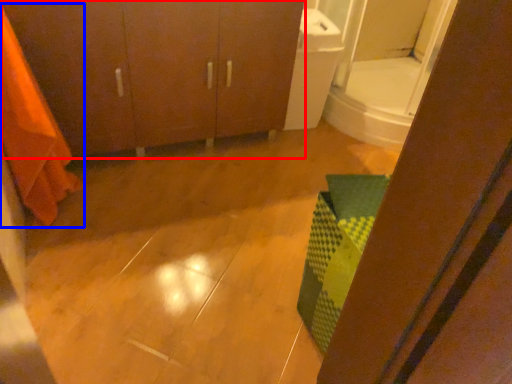
Question: Which point is further to the camera, bathroom cabinet (highlighted by a red box) or shower curtain (highlighted by a blue box)?

Choices:
 (A) bathroom cabinet
 (B) shower curtain

Answer: (A)